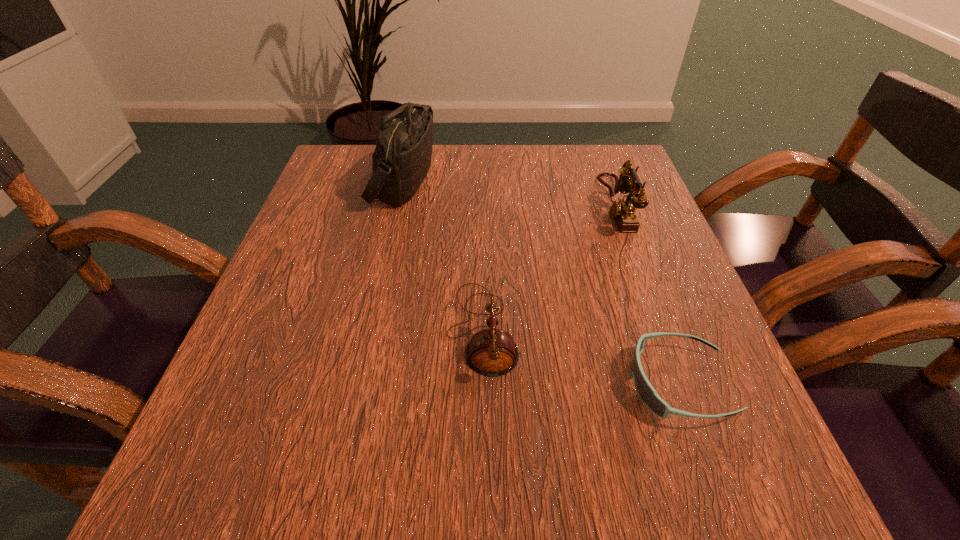
At what (x,y) coordinates should I click in order to perform the action: click on the tallest object. Please return your answer as a coordinate pair (x, y). The width and height of the screenshot is (960, 540). Looking at the image, I should click on (401, 160).

Find the location of a particular element. the leftmost object is located at coordinates (401, 160).

You are a GUI agent. You are given a task and a screenshot of the screen. Output one action in this format:
    pyautogui.click(x=<x>, y=<y>)
    Task: Click on the third shortest object
    
    Given the screenshot: What is the action you would take?
    pyautogui.click(x=622, y=211)

The image size is (960, 540). What are the coordinates of `the taller telephone` in the screenshot? It's located at (622, 211).

This screenshot has height=540, width=960. Identify the location of the nearer telephone. coord(491,352).

Find the location of `the left telephone`. the left telephone is located at coordinates (491, 352).

Identify the location of the shortest object. The width and height of the screenshot is (960, 540). (646, 392).

In order to click on free location located at the front padded panel of the shoulder bag in this screenshot , I will do `click(494, 181)`.

This screenshot has width=960, height=540. In order to click on free spot located on the front-facing side of the right telephone in this screenshot , I will do `click(508, 205)`.

This screenshot has height=540, width=960. I want to click on free space located on the front-facing side of the right telephone, so click(x=498, y=205).